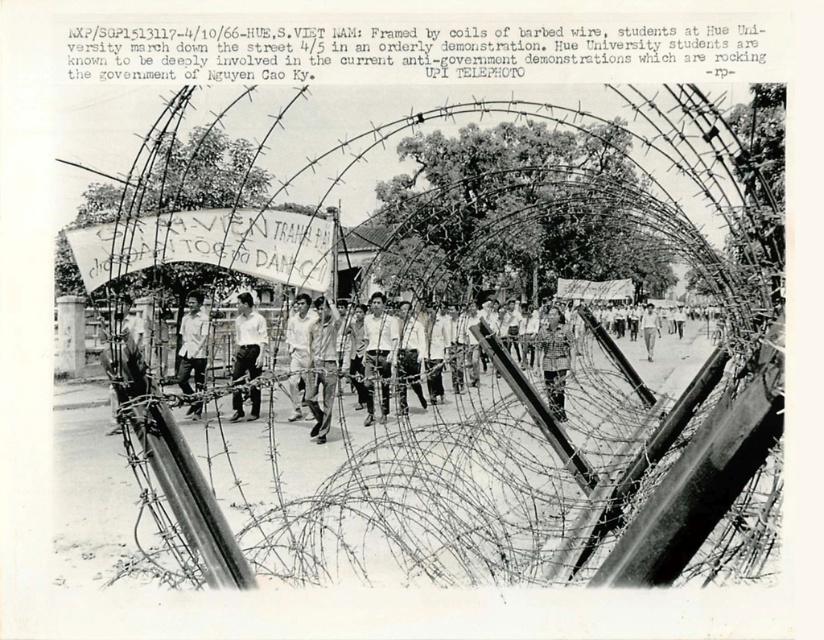
Question: Does light gray shirt at center appear over light gray uniform at center?

Choices:
 (A) yes
 (B) no

Answer: (B)

Question: Which point appears farthest from the camera in this image?

Choices:
 (A) (236, 330)
 (B) (563, 369)

Answer: (B)

Question: Does wire at center have a greater width compared to camouflage fabric uniform at center?

Choices:
 (A) no
 (B) yes

Answer: (B)

Question: Which point appears closest to the camera in this image?

Choices:
 (A) (298, 352)
 (B) (638, 211)
 (C) (239, 376)
 (D) (556, 328)

Answer: (A)

Question: Can you confirm if wire at center is positioned to the right of light gray uniform at center?

Choices:
 (A) no
 (B) yes

Answer: (B)

Question: Which object is positioned closest to the light brown leather jacket at center?

Choices:
 (A) wire at center
 (B) light gray shirt at center
 (C) camouflage fabric uniform at center
 (D) light gray uniform at center

Answer: (D)